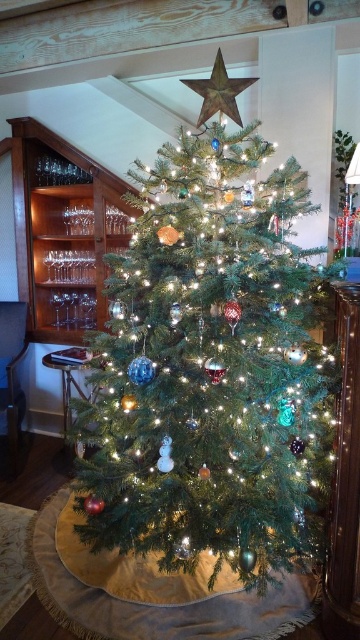
You are a child who wants to place a new ornament on the green matte christmas tree at center. The ornament is 10 cm in height. Can you determine if the metallic gold star at upper center will block the ornament from being placed at the top of the tree?

The green matte christmas tree at center is larger in size than the metallic gold star at upper center. Since the star is at the top, it may block the placement of the ornament. However, the ornament is only 10 cm tall, so it might fit below the star or on another part of the tree.

You are standing in front of the Christmas tree and want to place a new ornament. You have two points marked on the tree where you can hang it. The first point is at coordinate point (150, 209) and the second point is at coordinate point (194, 83). Which point is closer to you?

Point (150, 209) is closer to you than point (194, 83) because it is further to the camera, meaning it is positioned nearer in the 3D space of the image.

Consider the image. You are a child who wants to reach the metallic gold star at upper center on the green matte christmas tree at center. The tree is 30 inches tall. Can you reach the star if you stand on your tiptoes and stretch your arm upwards?

The metallic gold star at upper center is 30.02 inches away from the green matte christmas tree at center. Since the tree is 30 inches tall, the star is just slightly above the top of the tree. If the child stands on tiptoes and stretches their arm, they might barely reach it, but it would be very challenging due to the minimal extra height needed.